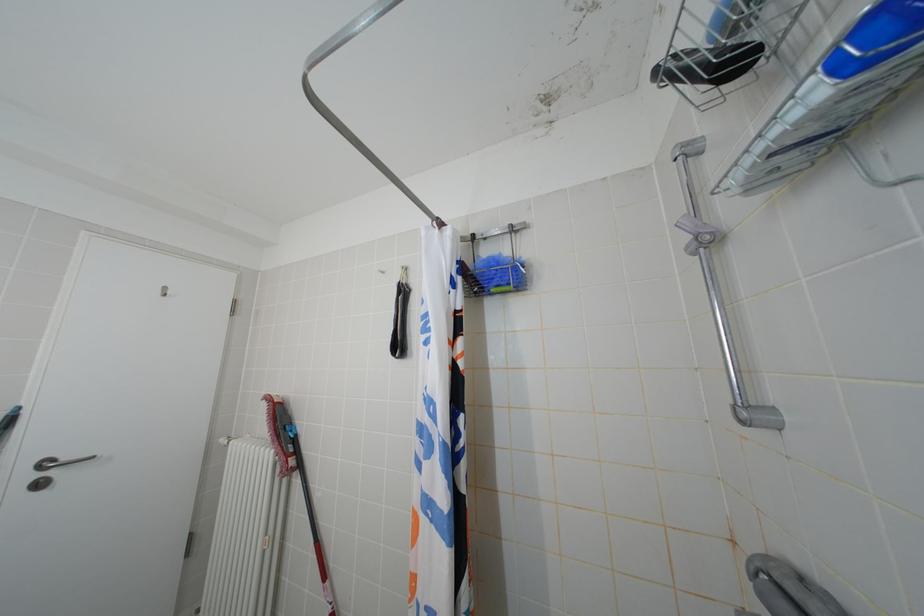
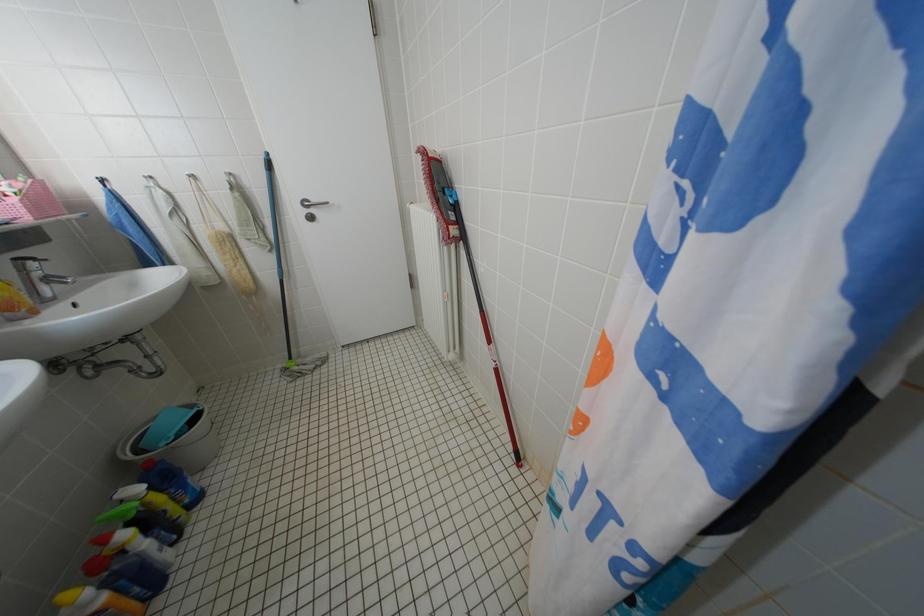
The images are taken continuously from a first-person perspective. In which direction is your viewpoint rotating?

The rotation direction of the camera is left-down.